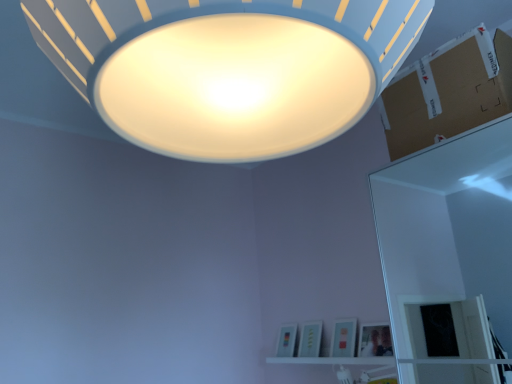
Question: Considering the positions of point (438, 94) and point (170, 130), is point (438, 94) closer or farther from the camera than point (170, 130)?

Choices:
 (A) farther
 (B) closer

Answer: (A)

Question: Is brown cardboard at upper right inside the boundaries of white matte lampshade at upper center, or outside?

Choices:
 (A) outside
 (B) inside

Answer: (A)

Question: Estimate the real-world distances between objects in this image. Which object is closer to the white glossy shelf at lower center?

Choices:
 (A) brown cardboard at upper right
 (B) white matte lampshade at upper center

Answer: (A)

Question: Considering the real-world distances, which object is closest to the white glossy shelf at lower center?

Choices:
 (A) brown cardboard at upper right
 (B) white matte lampshade at upper center

Answer: (A)